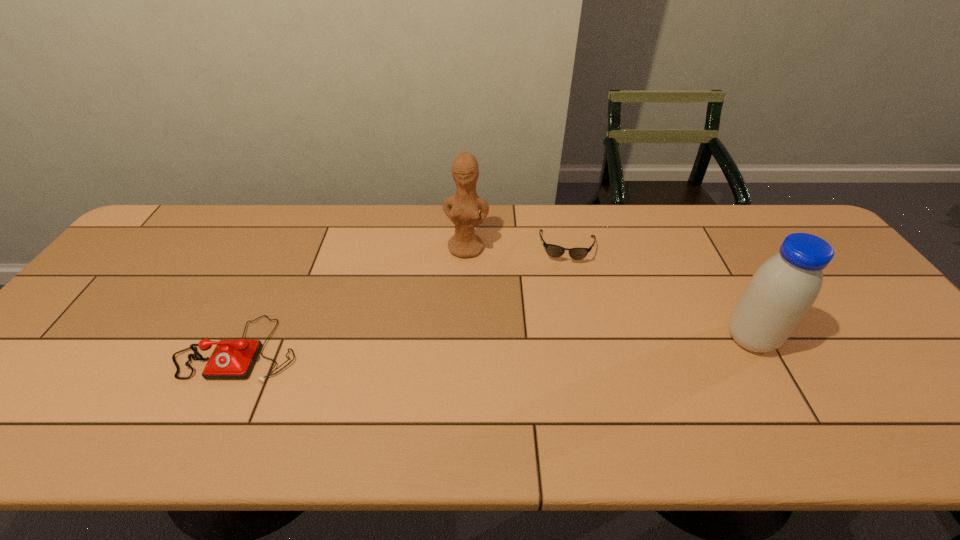
Image resolution: width=960 pixels, height=540 pixels. What are the coordinates of `the second shortest object` in the screenshot? It's located at (231, 359).

I want to click on the leftmost object, so click(231, 359).

Locate an element on the screen. soya milk is located at coordinates (783, 289).

The width and height of the screenshot is (960, 540). In order to click on the shortest object in this screenshot , I will do `click(552, 250)`.

Identify the location of the third object from left to right. (552, 250).

Where is `the third object from right to left`? the third object from right to left is located at coordinates (462, 209).

The image size is (960, 540). I want to click on vacant space located on the back of the soya milk, so click(732, 305).

Locate an element on the screen. vacant space positioned 0.200m on the front-facing side of the sunglasses is located at coordinates click(563, 315).

Where is `vacant space located 0.400m on the front-facing side of the sunglasses`? vacant space located 0.400m on the front-facing side of the sunglasses is located at coordinates (559, 381).

Locate an element on the screen. Image resolution: width=960 pixels, height=540 pixels. free location located on the front-facing side of the sunglasses is located at coordinates (564, 299).